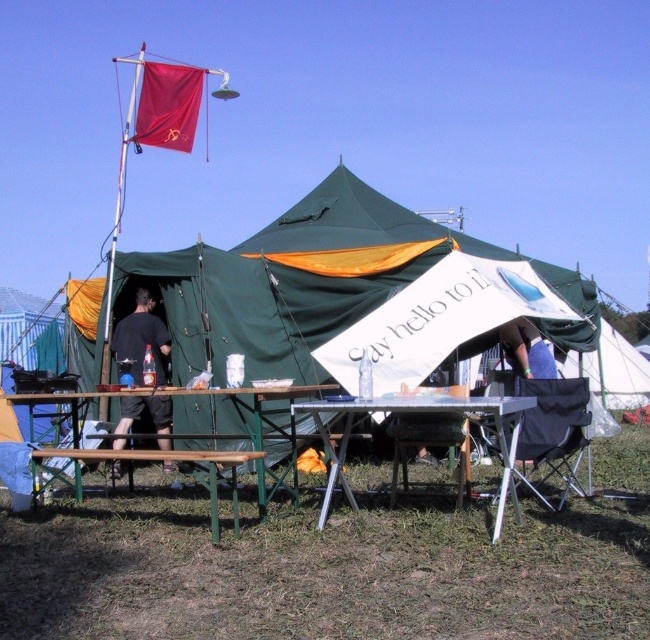
Which is more to the right, green metal table at center or brown wooden table at lower center?

From the viewer's perspective, brown wooden table at lower center appears more on the right side.

Is point (23, 493) farther from viewer compared to point (237, 460)?

Yes, point (23, 493) is farther from viewer.

Find the location of a particular element. The width and height of the screenshot is (650, 640). green metal table at center is located at coordinates (136, 397).

Is green metal table at center thinner than wooden chair at lower center?

No, green metal table at center is not thinner than wooden chair at lower center.

Does green metal table at center appear over wooden chair at lower center?

Correct, green metal table at center is located above wooden chair at lower center.

Find the location of `green metal table at center`. green metal table at center is located at coordinates (136, 397).

Which is more to the right, metallic silver table at center or wooden chair at lower center?

wooden chair at lower center is more to the right.

You are a GUI agent. You are given a task and a screenshot of the screen. Output one action in this format:
    pyautogui.click(x=<x>, y=<y>)
    Task: Click on the metallic silver table at center
    
    Given the screenshot: What is the action you would take?
    pyautogui.click(x=419, y=413)

Does point (313, 412) come behind point (395, 483)?

That is False.

Where is `metallic silver table at center`? metallic silver table at center is located at coordinates click(x=419, y=413).